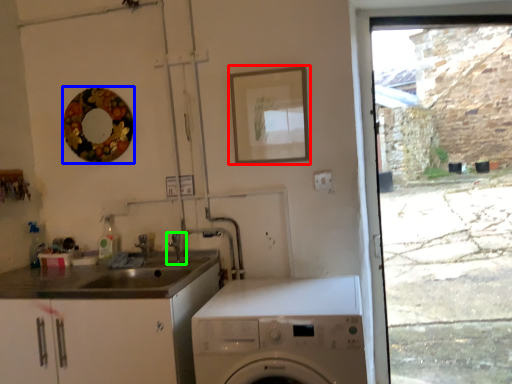
Question: Estimate the real-world distances between objects in this image. Which object is farther from picture frame (highlighted by a red box), mirror (highlighted by a blue box) or tap (highlighted by a green box)?

Choices:
 (A) mirror
 (B) tap

Answer: (B)